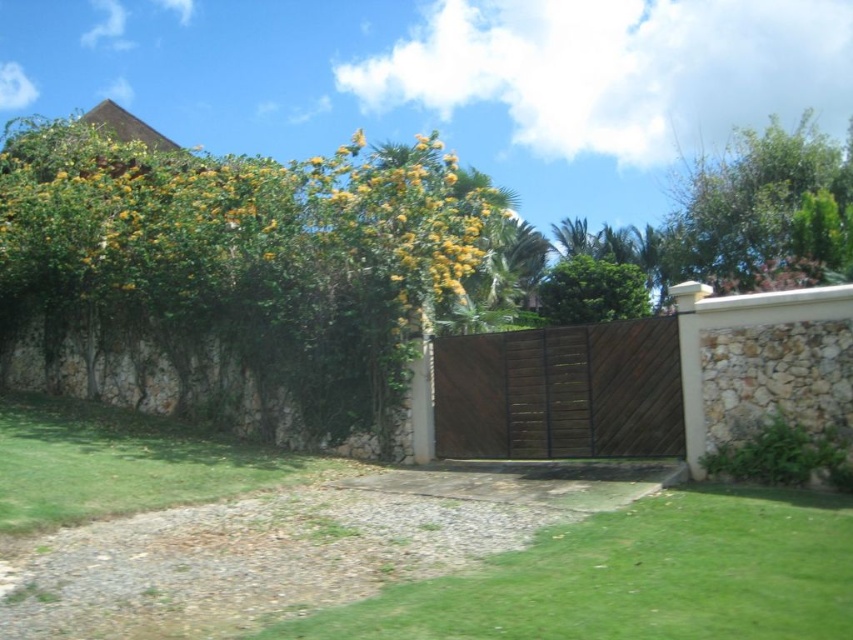
Is green leafy tree at upper right thinner than green leafy tree at center?

In fact, green leafy tree at upper right might be wider than green leafy tree at center.

Can you confirm if green leafy tree at upper right is shorter than green leafy tree at center?

In fact, green leafy tree at upper right may be taller than green leafy tree at center.

Between point (727, 250) and point (547, 298), which one is positioned behind?

The point (727, 250) is more distant.

Locate an element on the screen. green leafy tree at upper right is located at coordinates (762, 211).

Does green leafy bush at upper left have a lesser width compared to green leafy tree at center?

In fact, green leafy bush at upper left might be wider than green leafy tree at center.

Is green leafy bush at upper left shorter than green leafy tree at center?

No.

Locate an element on the screen. The height and width of the screenshot is (640, 853). green leafy bush at upper left is located at coordinates (231, 221).

Who is positioned more to the right, green grass at lower center or green leafy tree at center?

green leafy tree at center is more to the right.

Which is above, green grass at lower center or green leafy tree at center?

green leafy tree at center is higher up.

The width and height of the screenshot is (853, 640). What do you see at coordinates (636, 577) in the screenshot?
I see `green grass at lower center` at bounding box center [636, 577].

Find the location of a particular element. Image resolution: width=853 pixels, height=640 pixels. green grass at lower center is located at coordinates (636, 577).